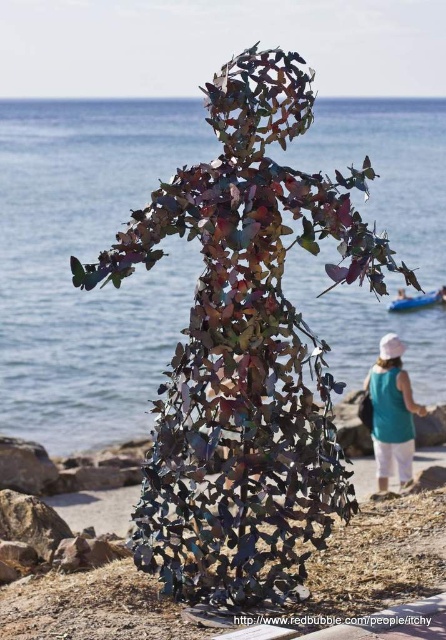
Who is shorter, metallic leaf sculpture at center or teal fabric dress at lower right?

teal fabric dress at lower right

Can you confirm if metallic leaf sculpture at center is positioned to the left of teal fabric dress at lower right?

Indeed, metallic leaf sculpture at center is positioned on the left side of teal fabric dress at lower right.

Locate an element on the screen. metallic leaf sculpture at center is located at coordinates (244, 349).